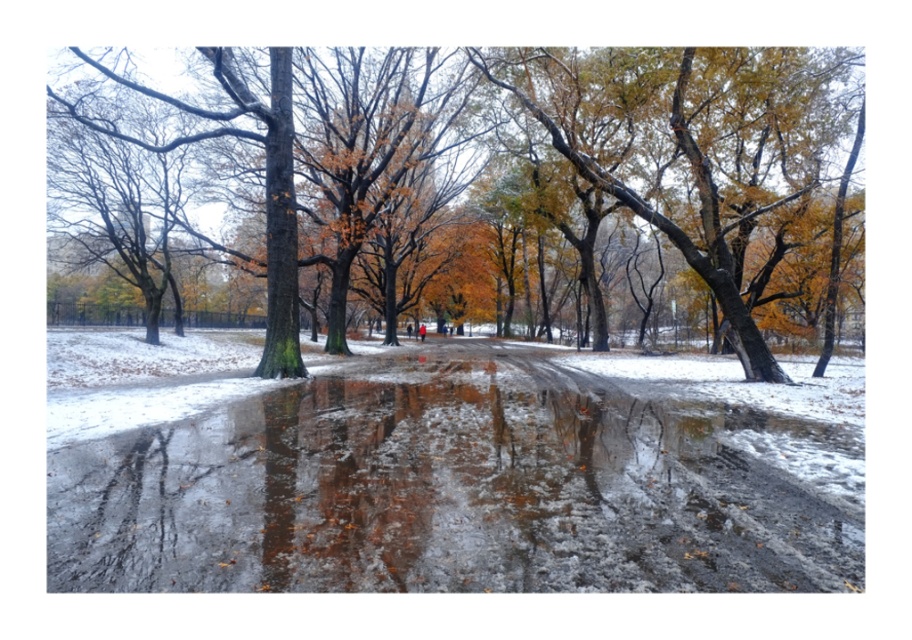
Between green matte tree at center and yellow-green bark tree at upper right, which one appears on the right side from the viewer's perspective?

yellow-green bark tree at upper right

Does green matte tree at center come in front of yellow-green bark tree at upper right?

Yes, green matte tree at center is closer to the viewer.

Does point (717, 176) come closer to viewer compared to point (769, 276)?

Yes, it is in front of point (769, 276).

Locate an element on the screen. The height and width of the screenshot is (640, 912). green matte tree at center is located at coordinates (700, 152).

Who is taller, slick asphalt puddle at center or green matte tree at center?

With more height is green matte tree at center.

Between slick asphalt puddle at center and green matte tree at center, which one appears on the right side from the viewer's perspective?

green matte tree at center

Describe the element at coordinates (462, 490) in the screenshot. I see `slick asphalt puddle at center` at that location.

The height and width of the screenshot is (640, 912). In order to click on slick asphalt puddle at center in this screenshot , I will do `click(462, 490)`.

Who is taller, slick asphalt puddle at center or yellow-green bark tree at upper right?

With more height is yellow-green bark tree at upper right.

What do you see at coordinates (462, 490) in the screenshot? I see `slick asphalt puddle at center` at bounding box center [462, 490].

I want to click on slick asphalt puddle at center, so click(462, 490).